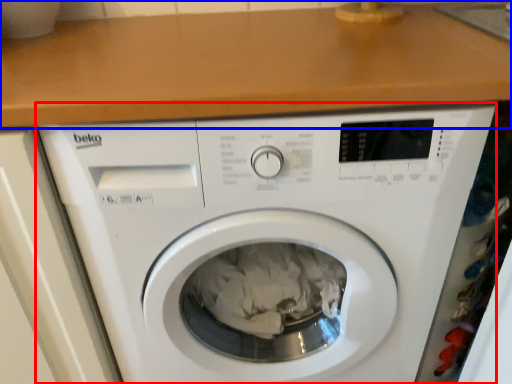
Question: Which point is closer to the camera, washing machine (highlighted by a red box) or counter top (highlighted by a blue box)?

Choices:
 (A) washing machine
 (B) counter top

Answer: (B)